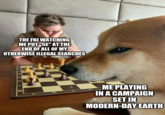
The height and width of the screenshot is (115, 165). In order to click on wall in this screenshot , I will do `click(97, 9)`.